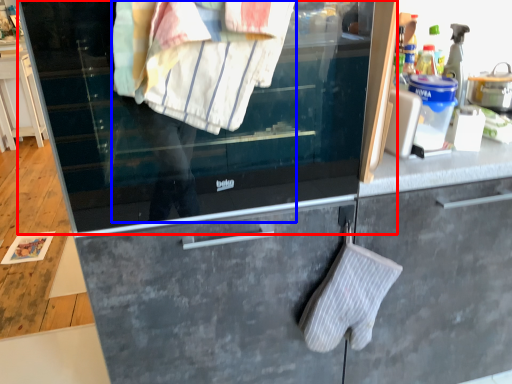
Question: Among these objects, which one is farthest to the camera, window (highlighted by a red box) or person (highlighted by a blue box)?

Choices:
 (A) window
 (B) person

Answer: (A)